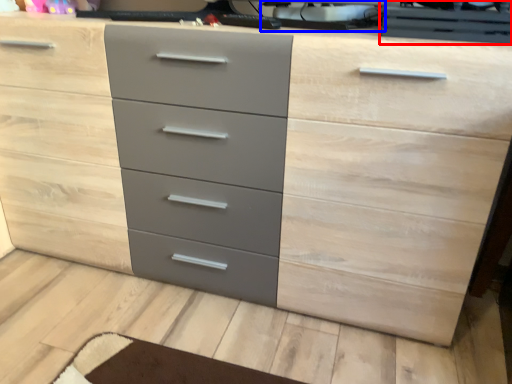
Question: Which point is further to the camera, desktop computer (highlighted by a red box) or desktop computer (highlighted by a blue box)?

Choices:
 (A) desktop computer
 (B) desktop computer

Answer: (B)